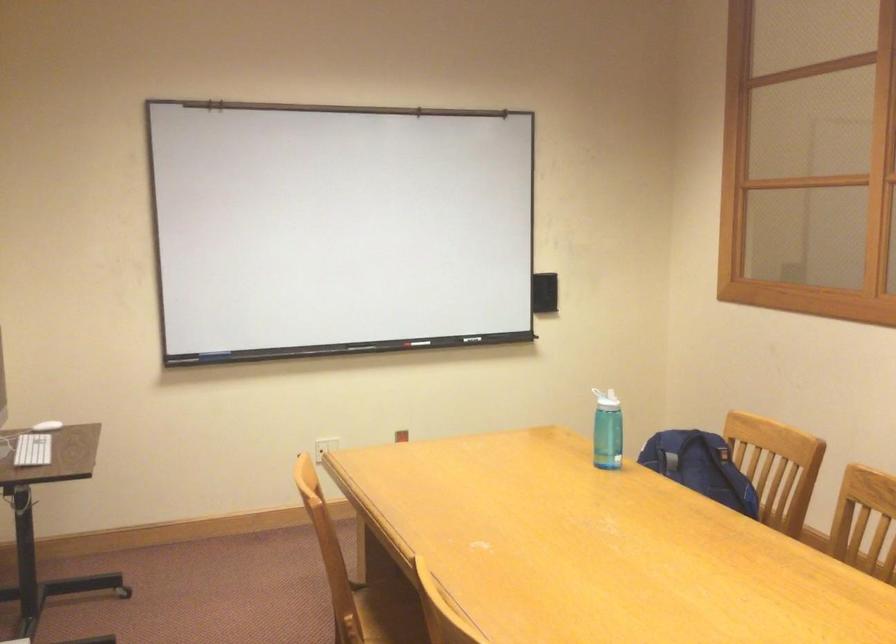
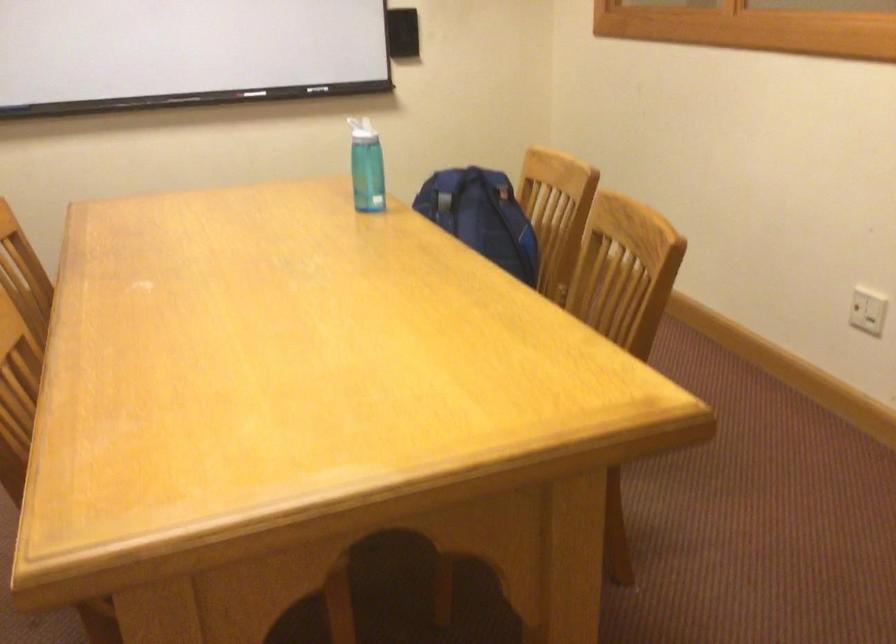
Find the pixel in the second image that matches pixel 702 478 in the first image.

(481, 216)